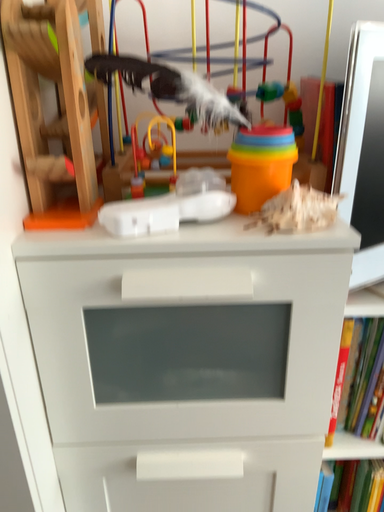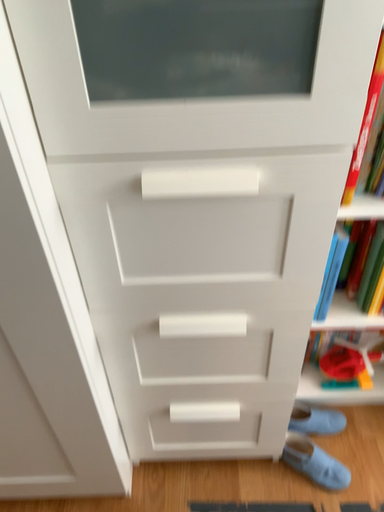
Question: How did the camera likely rotate when shooting the video?

Choices:
 (A) rotated downward
 (B) rotated upward

Answer: (A)